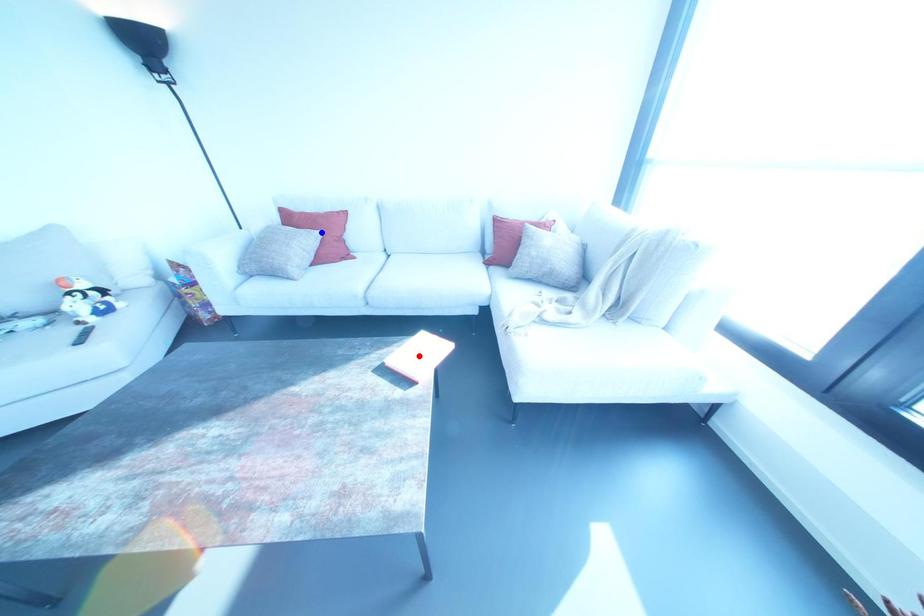
Question: Two points are marked on the image. Which point is closer to the camera?

Choices:
 (A) Blue point is closer.
 (B) Red point is closer.

Answer: (B)